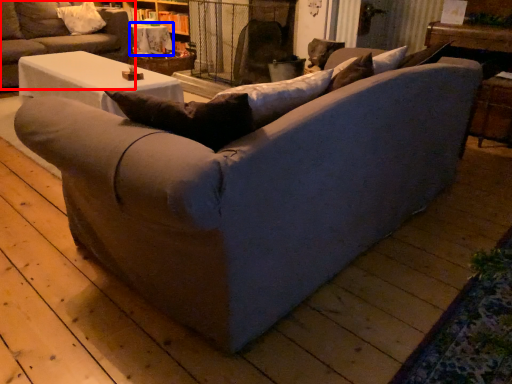
Question: Which of the following is the farthest to the observer, studio couch (highlighted by a red box) or table (highlighted by a blue box)?

Choices:
 (A) studio couch
 (B) table

Answer: (B)